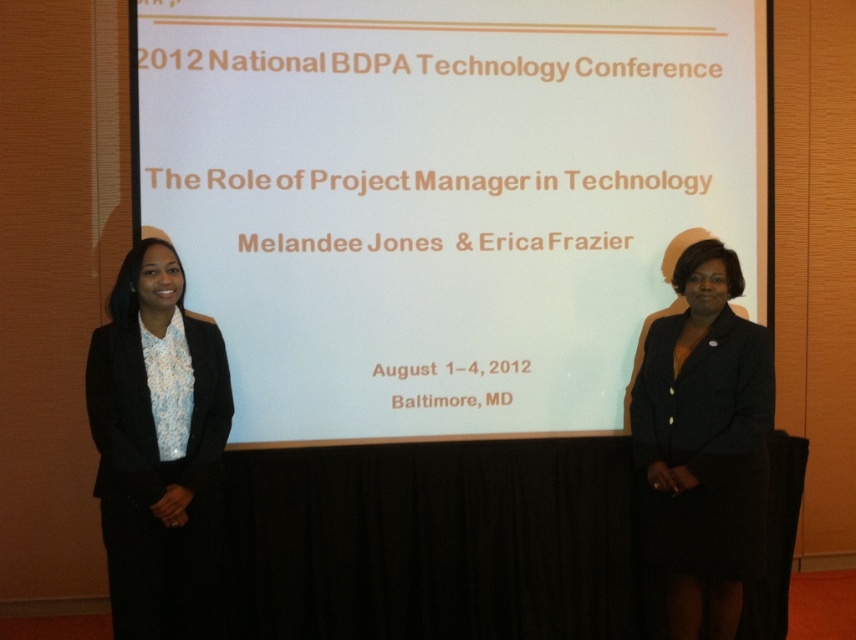
You are attending the 2012 National BDPA Technology Conference and notice two presenters on stage. The woman on the left is wearing a black satin blazer at left, and the woman on the right is wearing a black fabric skirt at right. Which piece of clothing is shorter?

The black satin blazer at left is shorter than the black fabric skirt at right.

You are a photographer taking a picture of the two points in the image. Which point, point (152, 259) or point (673, 337), will appear larger in your photo?

Point (152, 259) is closer to the camera than point (673, 337), so it will appear larger in the photo.

In the scene shown: You are an attendee at the conference and want to take a photo of the black fabric skirt at right without the white matte projection screen at center blocking the view. Is this possible?

The black fabric skirt at right is behind the white matte projection screen at center, so taking a photo of the black fabric skirt at right without the screen blocking the view would not be possible from the current angle.